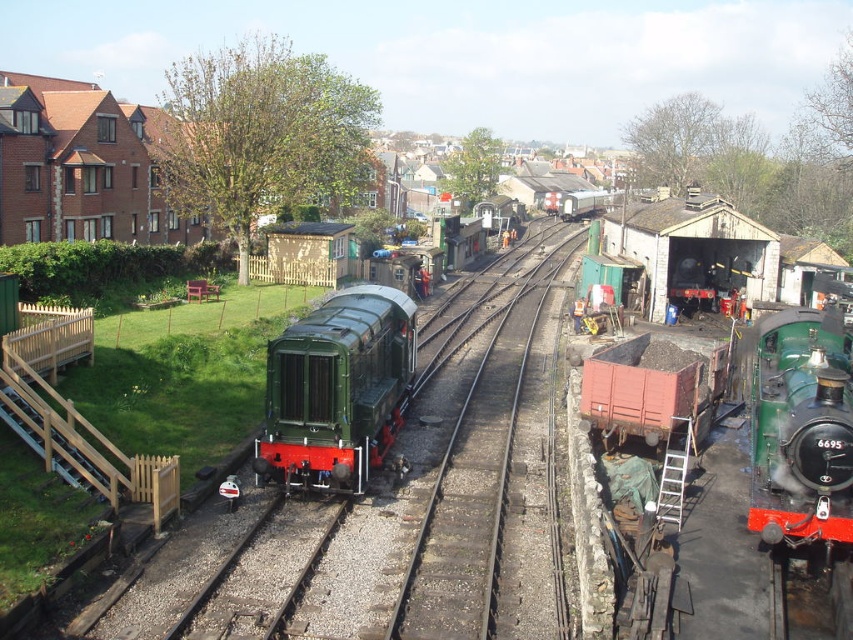
Question: Is green polished wood train at right to the left of rustic wood coal wagon at center right from the viewer's perspective?

Choices:
 (A) no
 (B) yes

Answer: (B)

Question: Observing the image, what is the correct spatial positioning of green polished metal train at center in reference to smooth metal tracks at center?

Choices:
 (A) above
 (B) below

Answer: (B)

Question: Among these points, which one is nearest to the camera?

Choices:
 (A) (311, 381)
 (B) (480, 362)
 (C) (767, 472)

Answer: (C)

Question: Which of the following is the farthest from the observer?

Choices:
 (A) (761, 371)
 (B) (685, 400)
 (C) (305, 378)

Answer: (B)

Question: Which object is the closest to the green polished metal train at center?

Choices:
 (A) green polished wood train at right
 (B) smooth metal tracks at center
 (C) rustic wood coal wagon at center right

Answer: (B)

Question: Is green polished metal train at center smaller than green polished wood train at right?

Choices:
 (A) yes
 (B) no

Answer: (B)